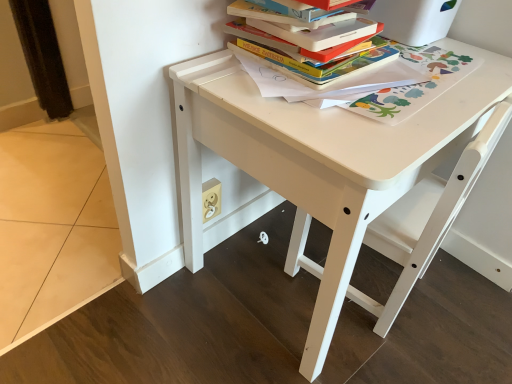
Where is `space that is in front of hardcover book at upper center`? The width and height of the screenshot is (512, 384). space that is in front of hardcover book at upper center is located at coordinates (332, 114).